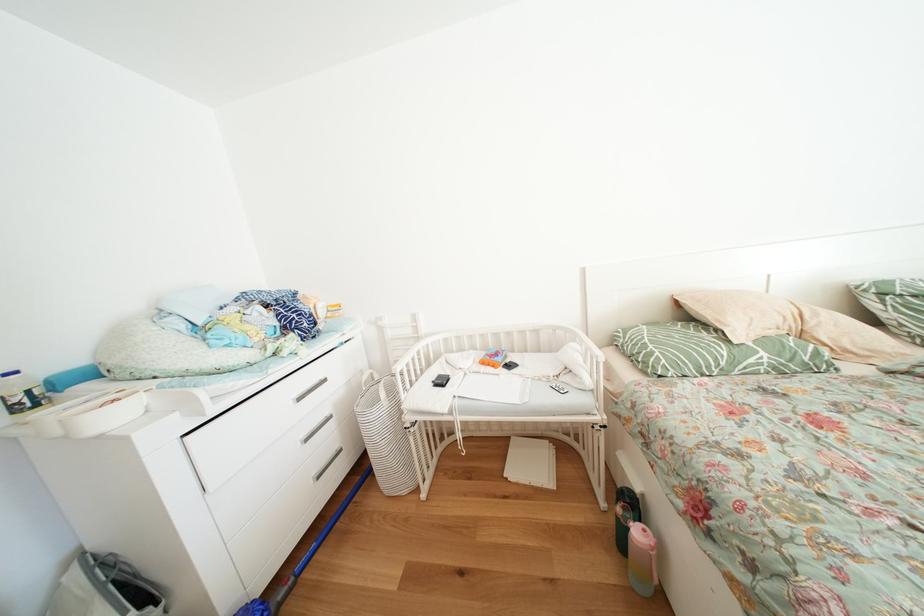
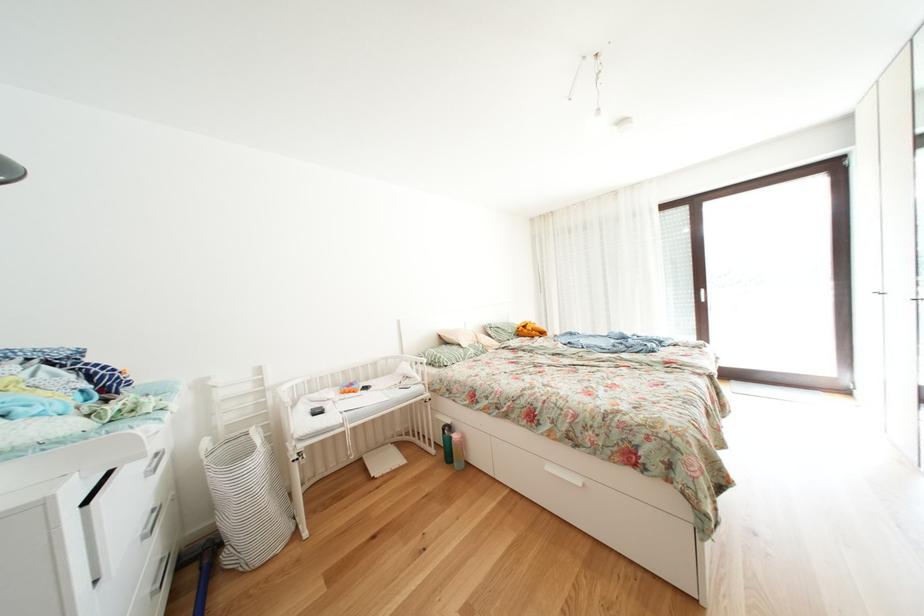
Where in the second image is the point corresponding to pixel 641 508 from the first image?

(458, 432)